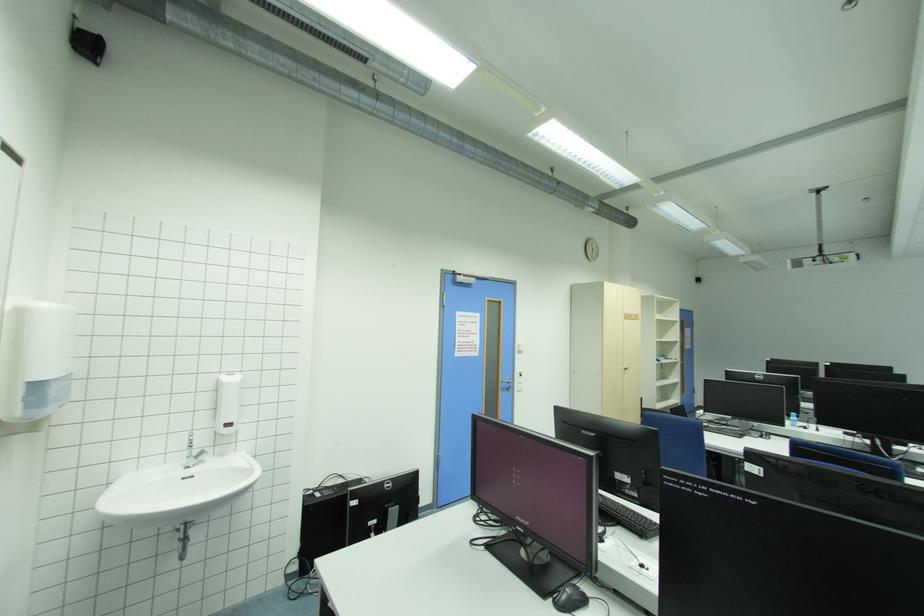
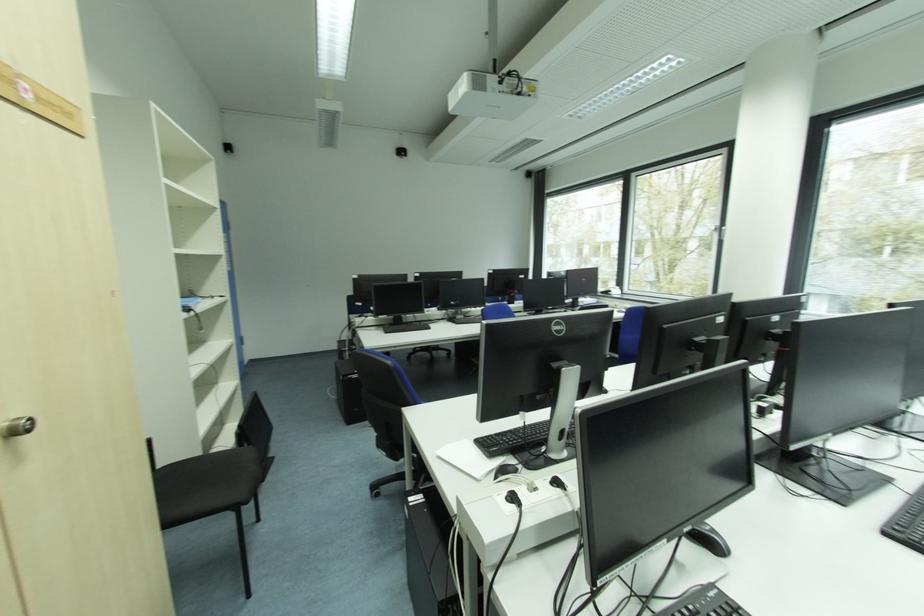
Where in the second image is the point corresponding to pixel 629 369 from the first image?

(6, 424)